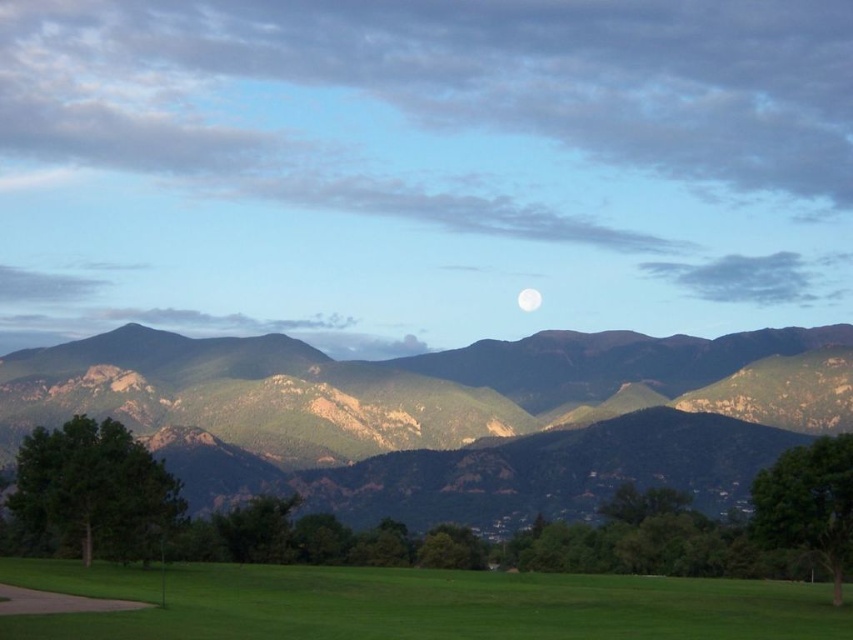
Question: Considering the real-world distances, which object is farthest from the green textured mountains at center?

Choices:
 (A) white glossy moon at center
 (B) green grass at lower center

Answer: (B)

Question: Which object is closer to the camera taking this photo?

Choices:
 (A) green textured mountains at center
 (B) white glossy moon at center
 (C) green grass at lower center

Answer: (C)

Question: Is green grass at lower center bigger than white glossy moon at center?

Choices:
 (A) yes
 (B) no

Answer: (A)

Question: Is green grass at lower center below white glossy moon at center?

Choices:
 (A) yes
 (B) no

Answer: (A)

Question: Is the position of green textured mountains at center less distant than that of green grass at lower center?

Choices:
 (A) no
 (B) yes

Answer: (A)

Question: Considering the real-world distances, which object is closest to the green grass at lower center?

Choices:
 (A) green textured mountains at center
 (B) white glossy moon at center

Answer: (A)